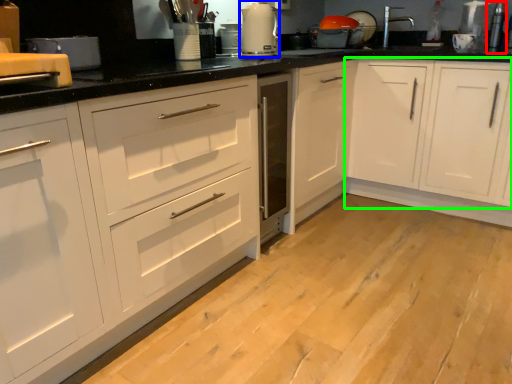
Question: Which object is positioned farthest from appliance (highlighted by a red box)? Select from kitchen appliance (highlighted by a blue box) and cabinetry (highlighted by a green box).

Choices:
 (A) kitchen appliance
 (B) cabinetry

Answer: (A)